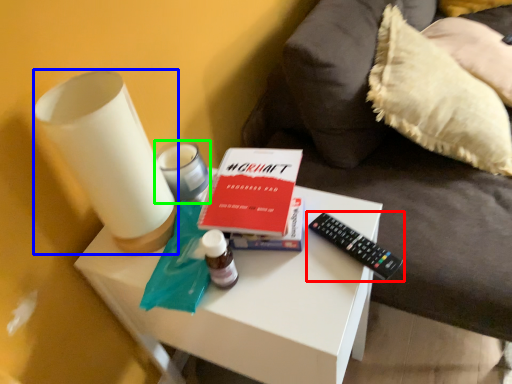
Question: Considering the real-world distances, which object is farthest from remote control (highlighted by a red box)? candle holder (highlighted by a blue box) or candle holder (highlighted by a green box)?

Choices:
 (A) candle holder
 (B) candle holder

Answer: (A)